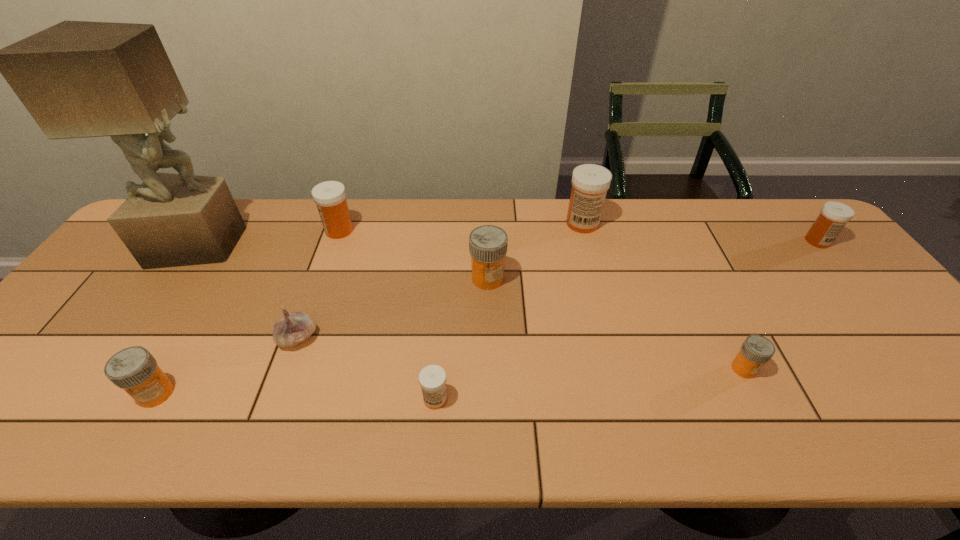
Where is `unoccupied position between the second medicine from left to right and the tallest object`? The height and width of the screenshot is (540, 960). unoccupied position between the second medicine from left to right and the tallest object is located at coordinates (271, 237).

Where is `vacant point located between the rightmost orange medicine and the leftmost medicine`? vacant point located between the rightmost orange medicine and the leftmost medicine is located at coordinates (450, 381).

Where is `vacant point located between the gray sculpture and the second orange medicine from left to right`? vacant point located between the gray sculpture and the second orange medicine from left to right is located at coordinates (345, 261).

Locate an element on the screen. The height and width of the screenshot is (540, 960). empty space that is in between the fourth nearest medicine and the leftmost orange medicine is located at coordinates (322, 336).

What are the coordinates of `free spot between the nearest white medicine and the second white medicine from right to left` in the screenshot? It's located at (509, 311).

This screenshot has height=540, width=960. I want to click on free spot between the leftmost orange medicine and the biggest orange medicine, so click(322, 336).

Select which object is the sixth closest to the third biggest white medicine. Please provide its 2D coordinates. Your answer should be formatted as a tuple, i.e. [(x, y)], where the tuple contains the x and y coordinates of a point satisfying the conditions above.

[(292, 328)]

What are the coordinates of `object identified as the fifth closest to the third white medicine from right to left` in the screenshot? It's located at (590, 182).

Identify which medicine is the sixth closest to the third medicine from right to left. Please provide its 2D coordinates. Your answer should be formatted as a tuple, i.e. [(x, y)], where the tuple contains the x and y coordinates of a point satisfying the conditions above.

[(133, 369)]

At what (x,y) coordinates should I click in order to perform the action: click on the closest medicine to the third medicine from right to left. Please return your answer as a coordinate pair (x, y). The image size is (960, 540). Looking at the image, I should click on (488, 244).